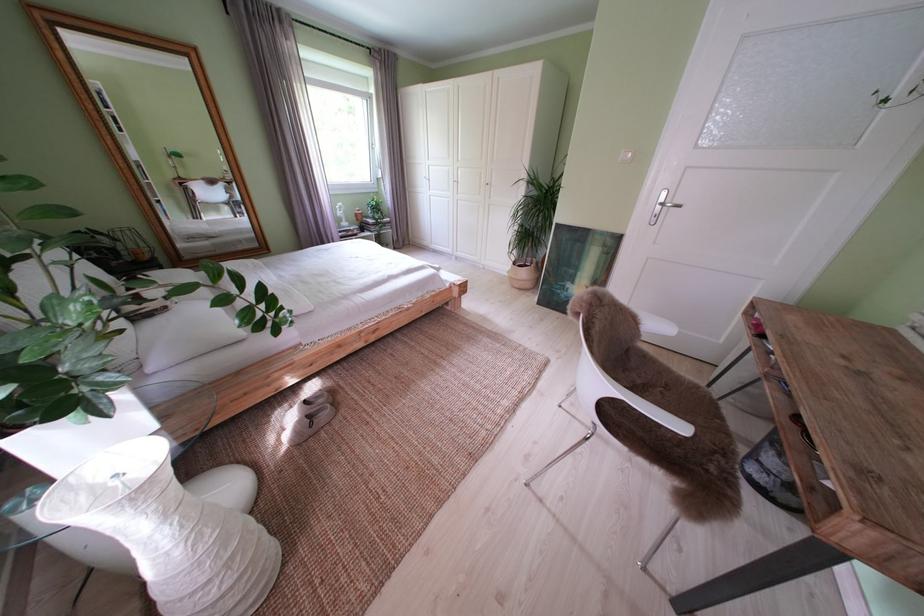
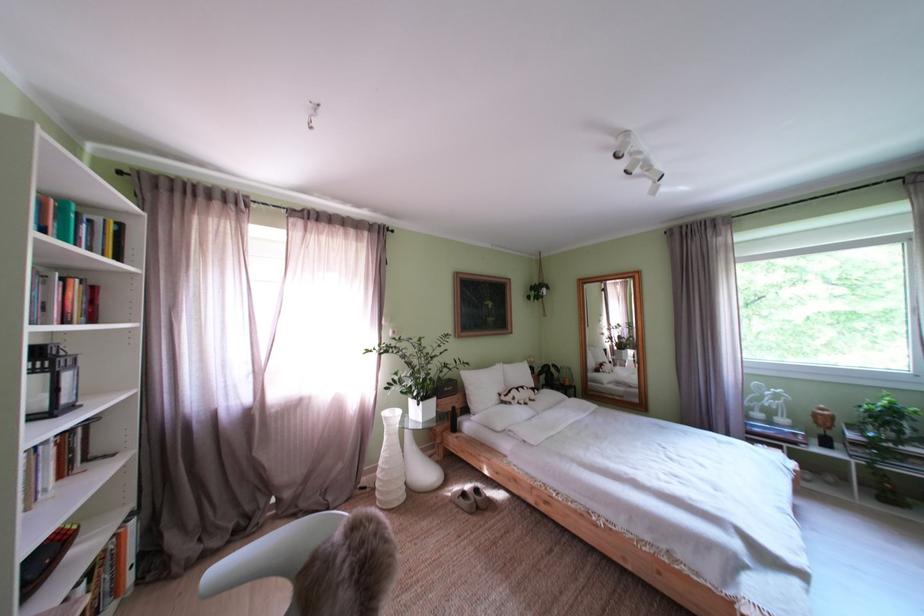
Find the pixel in the second image that matches [368,221] in the first image.

(825, 419)